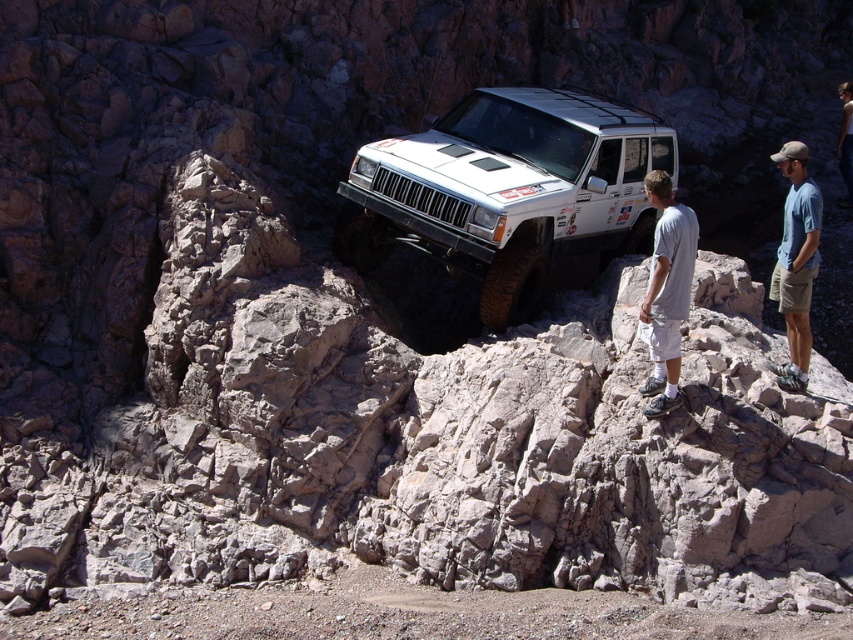
You are a hiker who has spotted a white matte suv at center and a blue cotton shirt at right in the rugged terrain. Which object is closer to you?

The blue cotton shirt at right is closer to you because the white matte suv at center is positioned over it, indicating the shirt is beneath the SUV in the scene.

Based on the photo, you are a photographer standing at the edge of a steep drop off. You want to take a photo of the white matte suv at center from a safe distance. The safe distance is 10 meters. Can you get close enough to take the photo without risking falling off the edge?

The photographer is 8.89 meters away from the white matte suv at center. Since the safe distance is 10 meters, the photographer can move closer to take the photo safely as 8.89 meters is within the safe limit.